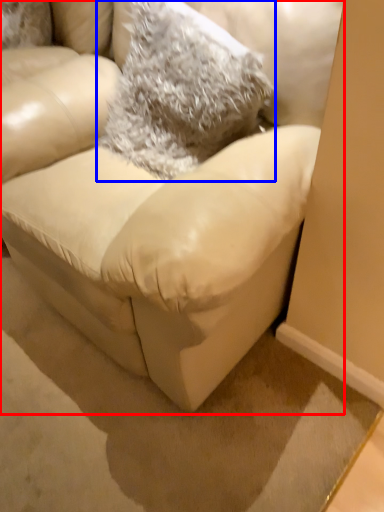
Question: Which object is further to the camera taking this photo, studio couch (highlighted by a red box) or throw pillow (highlighted by a blue box)?

Choices:
 (A) studio couch
 (B) throw pillow

Answer: (B)